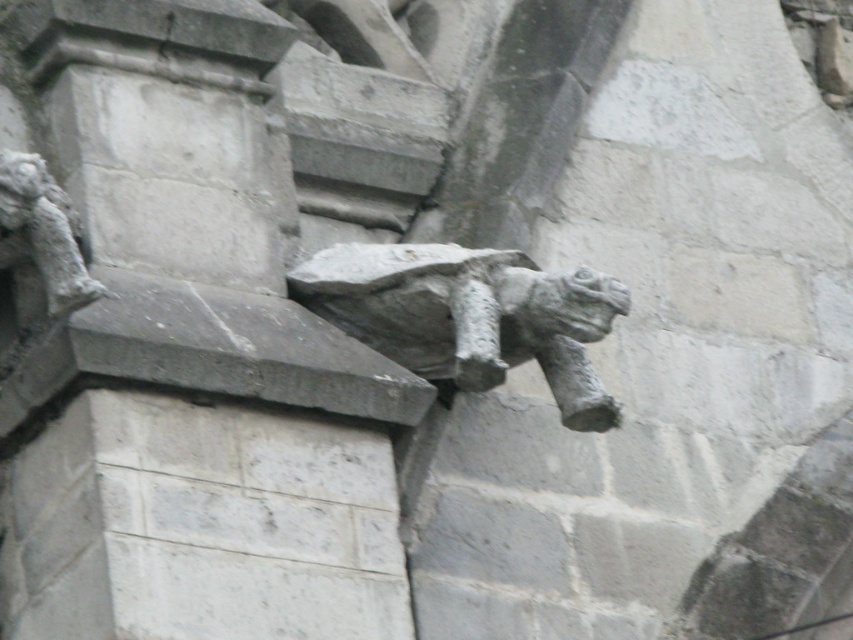
You are an architect analyzing the placement of the gray stone gargoyle at upper center in the image. What are the coordinates of its position?

The gray stone gargoyle at upper center is located at coordinates (469, 316).